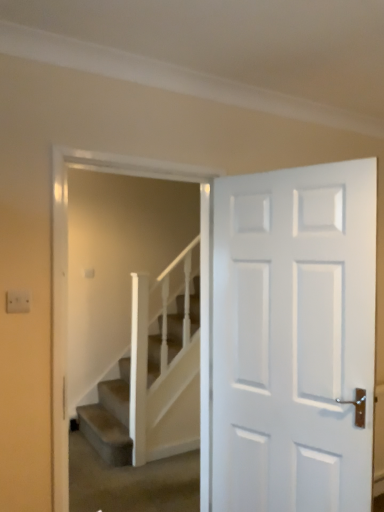
Question: Considering the relative positions of white matte door at right and white textured stairs at center in the image provided, is white matte door at right to the right of white textured stairs at center from the viewer's perspective?

Choices:
 (A) no
 (B) yes

Answer: (B)

Question: Is white matte door at right further to the viewer compared to white textured stairs at center?

Choices:
 (A) yes
 (B) no

Answer: (B)

Question: Is white matte door at right directly adjacent to white textured stairs at center?

Choices:
 (A) no
 (B) yes

Answer: (A)

Question: Is white matte door at right closer to camera compared to white textured stairs at center?

Choices:
 (A) no
 (B) yes

Answer: (B)

Question: Can you confirm if white matte door at right is bigger than white textured stairs at center?

Choices:
 (A) yes
 (B) no

Answer: (A)

Question: Is white matte door at right shorter than white textured stairs at center?

Choices:
 (A) yes
 (B) no

Answer: (B)

Question: Can you confirm if white textured stairs at center is taller than white matte door at right?

Choices:
 (A) no
 (B) yes

Answer: (A)

Question: Does white textured stairs at center have a lesser height compared to white matte door at right?

Choices:
 (A) yes
 (B) no

Answer: (A)

Question: Does white textured stairs at center turn towards white matte door at right?

Choices:
 (A) yes
 (B) no

Answer: (A)

Question: Does white textured stairs at center have a smaller size compared to white matte door at right?

Choices:
 (A) yes
 (B) no

Answer: (A)

Question: Considering the relative positions of white textured stairs at center and white matte door at right in the image provided, is white textured stairs at center to the left of white matte door at right from the viewer's perspective?

Choices:
 (A) no
 (B) yes

Answer: (B)

Question: Is white textured stairs at center completely or partially outside of white matte door at right?

Choices:
 (A) yes
 (B) no

Answer: (A)

Question: From their relative heights in the image, would you say white textured stairs at center is taller or shorter than white matte door at right?

Choices:
 (A) tall
 (B) short

Answer: (B)